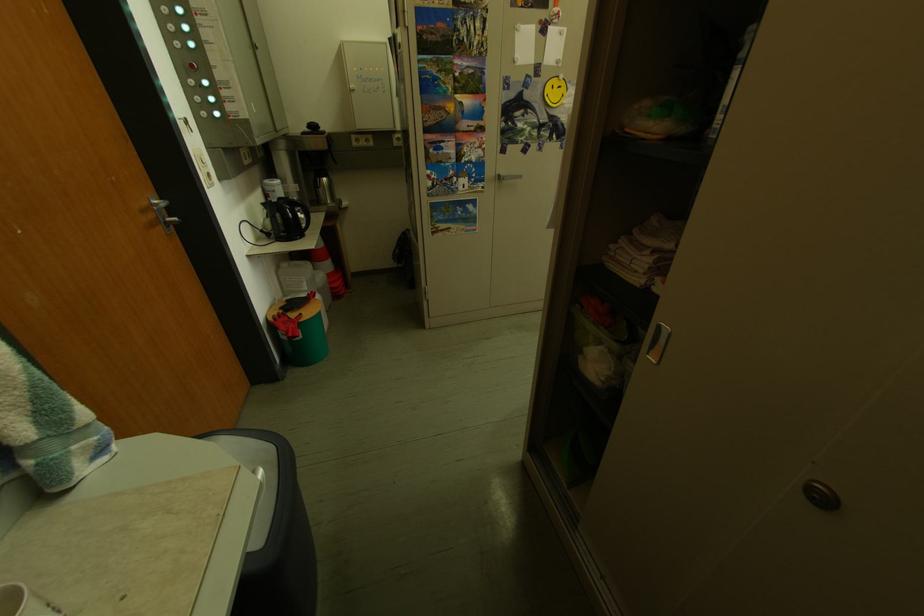
This screenshot has height=616, width=924. In order to click on green bin lid in this screenshot , I will do `click(273, 530)`.